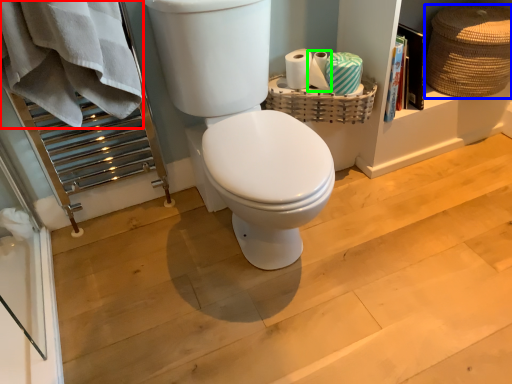
Question: Which object is positioned closest to bath towel (highlighted by a red box)? Select from basket (highlighted by a blue box) and toilet paper (highlighted by a green box).

Choices:
 (A) basket
 (B) toilet paper

Answer: (B)